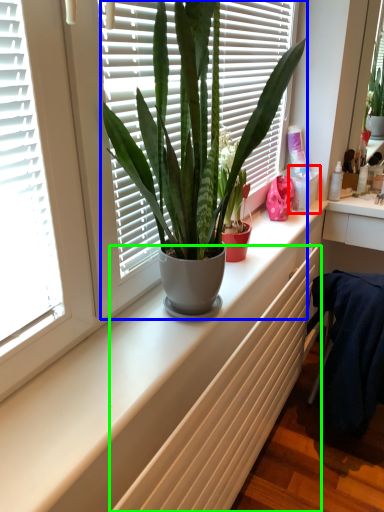
Question: Which is farther away from window box (highlighted by a red box)? houseplant (highlighted by a blue box) or radiator (highlighted by a green box)?

Choices:
 (A) houseplant
 (B) radiator

Answer: (A)